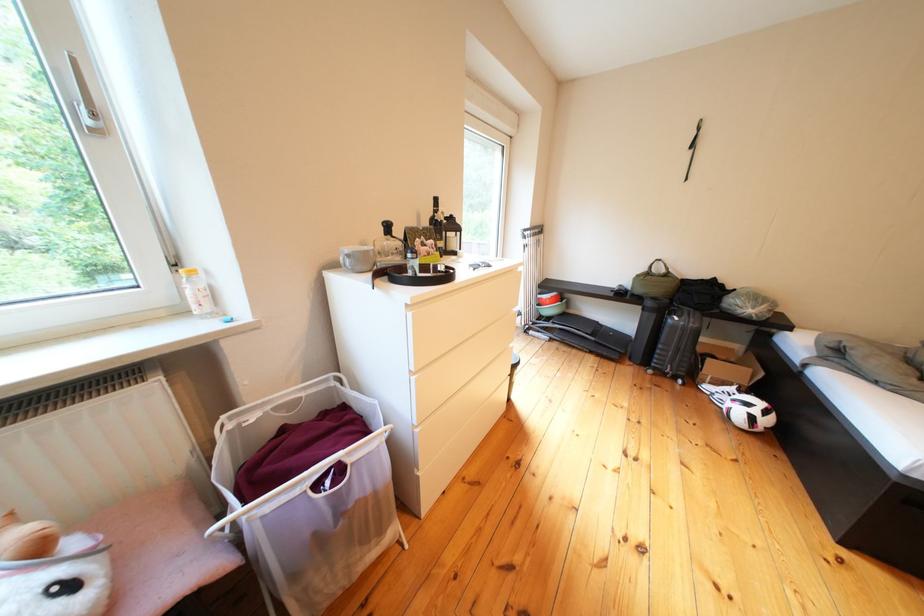
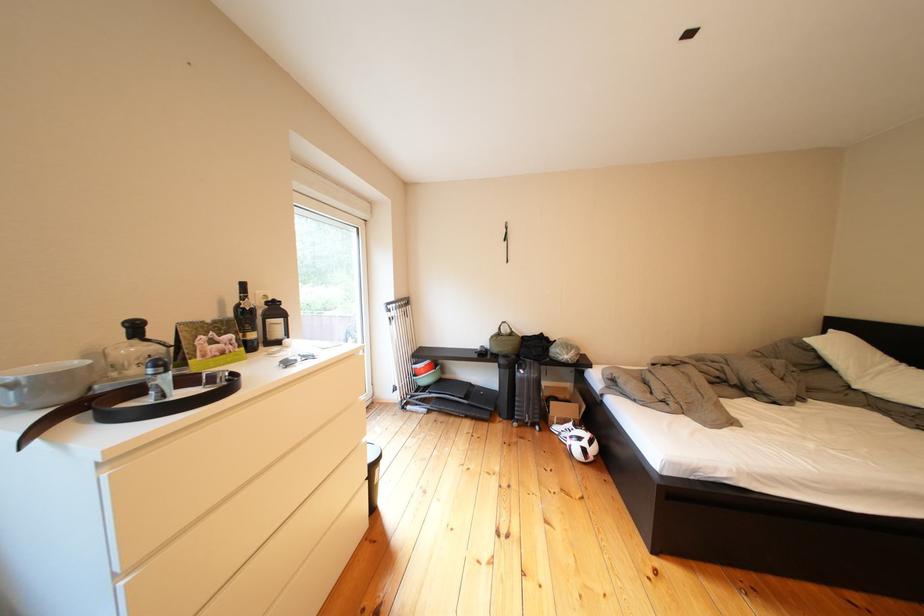
Where in the second image is the point corresponding to point 445,246 from the first image?

(245, 341)